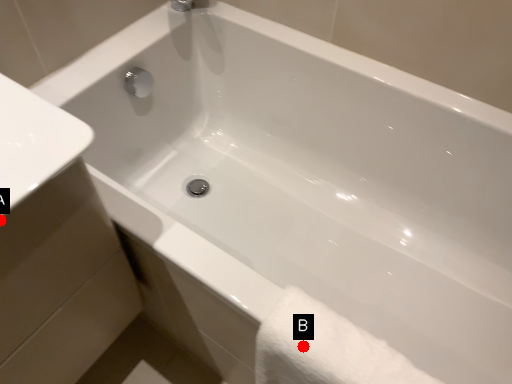
Question: Two points are circled on the image, labeled by A and B beside each circle. Which point is farther to the camera?

Choices:
 (A) A is further
 (B) B is further

Answer: (B)